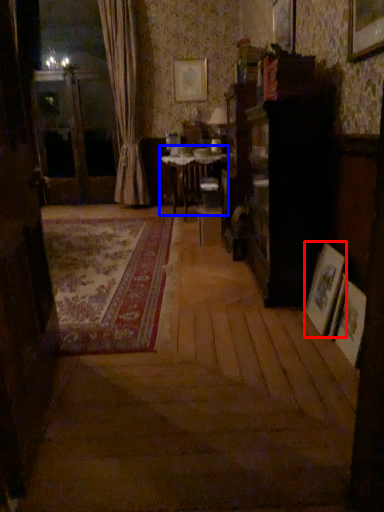
Question: Which object is further to the camera taking this photo, picture frame (highlighted by a red box) or table (highlighted by a blue box)?

Choices:
 (A) picture frame
 (B) table

Answer: (B)